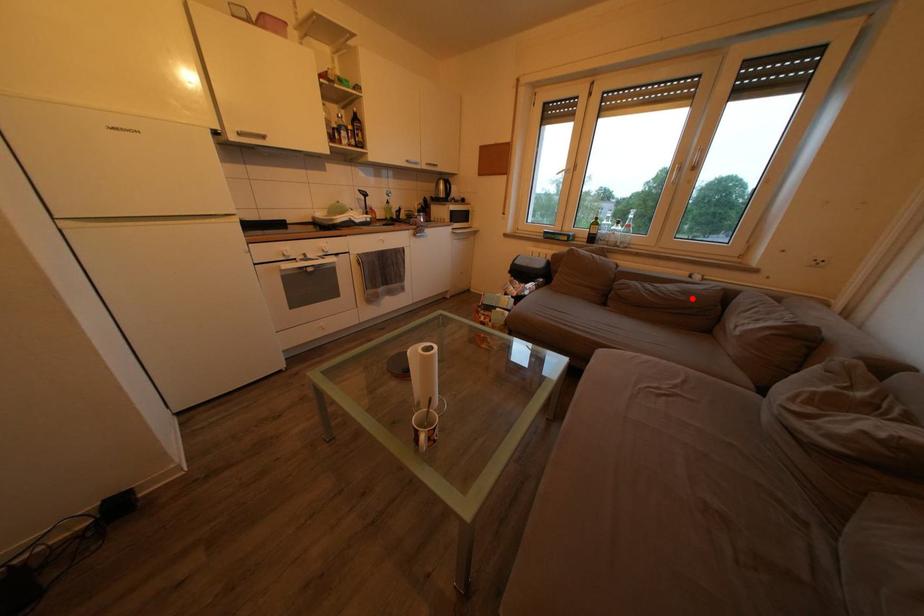
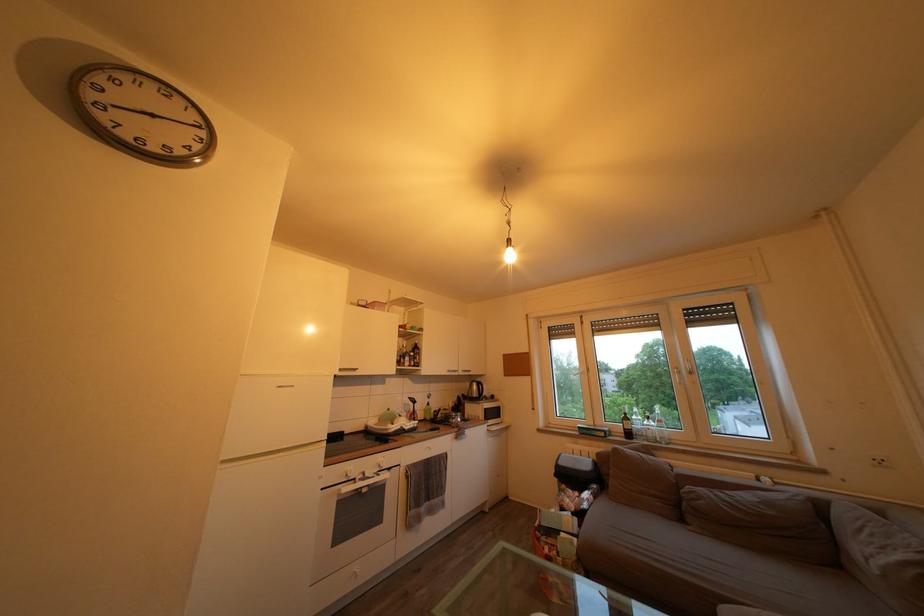
The point at the highlighted location is marked in the first image. Where is the corresponding point in the second image?

(774, 509)